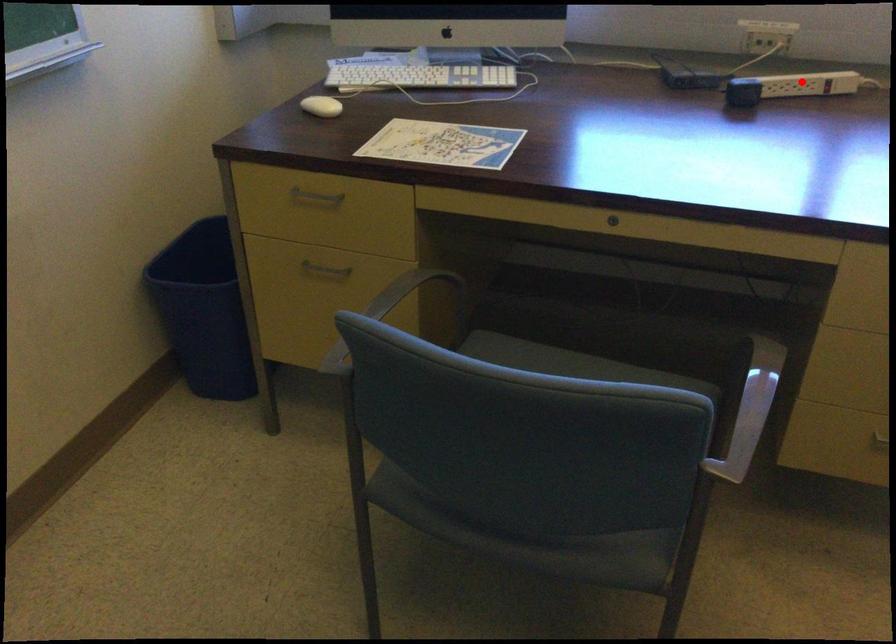
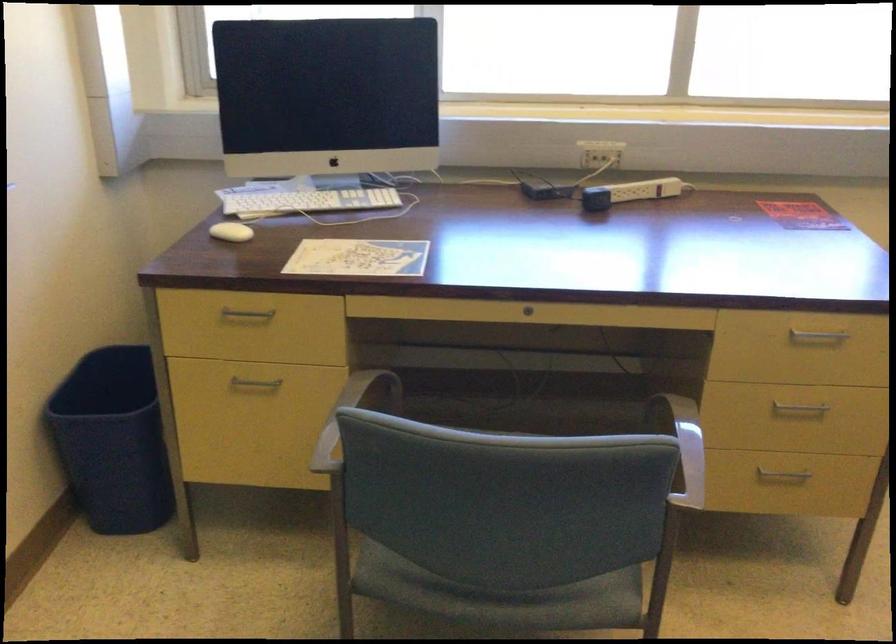
In the second image, find the point that corresponds to the highlighted location in the first image.

(642, 190)